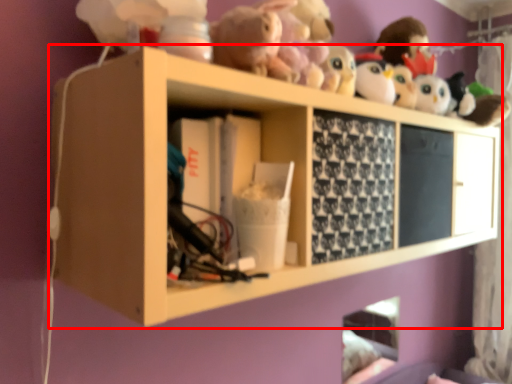
Question: Considering the relative positions of shelf (annotated by the red box) and curtain in the image provided, where is shelf (annotated by the red box) located with respect to the staircase?

Choices:
 (A) right
 (B) left

Answer: (B)